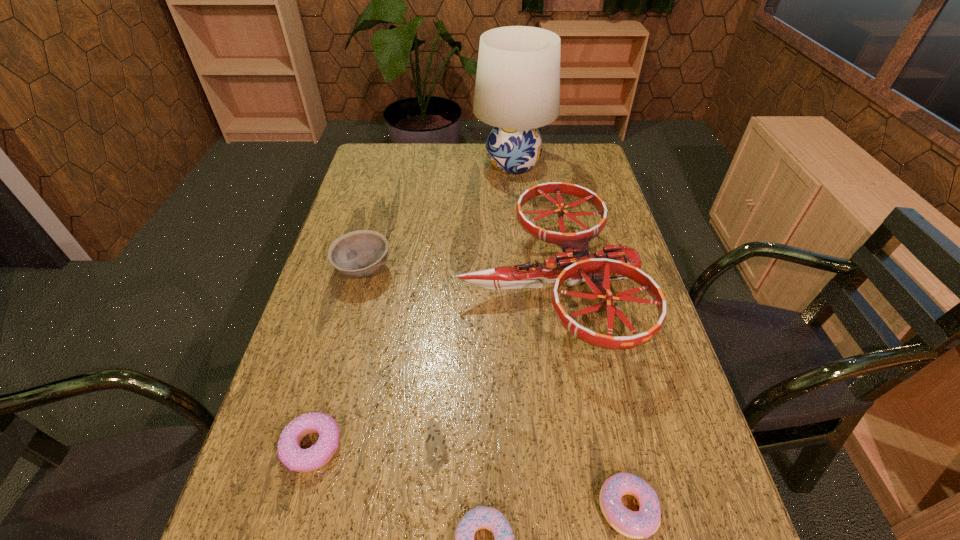
What are the coordinates of `free space located on the right of the bowl` in the screenshot? It's located at (431, 270).

At what (x,y) coordinates should I click in order to perform the action: click on free space located 0.090m on the right of the third nearest object. Please return your answer as a coordinate pair (x, y). This screenshot has width=960, height=540. Looking at the image, I should click on (387, 446).

Locate an element on the screen. object situated at the far edge is located at coordinates pyautogui.click(x=517, y=90).

Identify the location of bowl that is at the left edge. (357, 254).

In order to click on doughnut present at the left edge in this screenshot , I will do `click(290, 453)`.

Locate an element on the screen. The width and height of the screenshot is (960, 540). object that is at the right edge is located at coordinates (576, 264).

Image resolution: width=960 pixels, height=540 pixels. In order to click on free space at the far edge of the desktop in this screenshot , I will do `click(410, 154)`.

The height and width of the screenshot is (540, 960). I want to click on free space at the left edge of the desktop, so click(370, 276).

In order to click on vacant region at the right edge of the desktop in this screenshot , I will do `click(583, 205)`.

Image resolution: width=960 pixels, height=540 pixels. In order to click on free spot between the farthest object and the leftmost doughnut in this screenshot , I will do `click(413, 305)`.